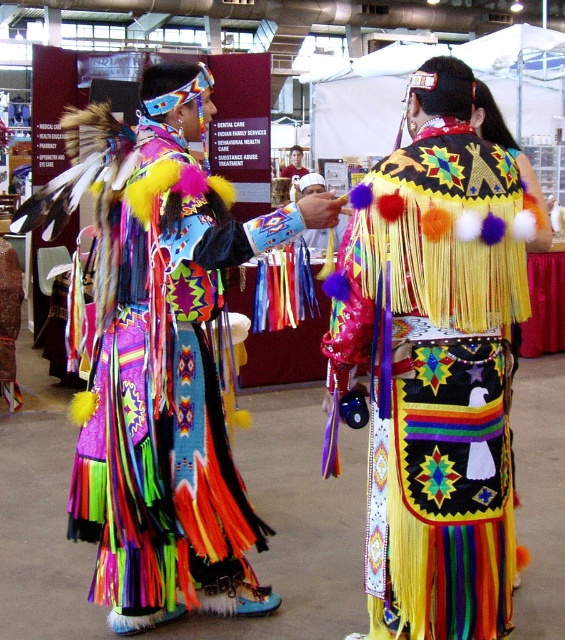
You are standing at the center of the image and see a point marked at coordinates (436, 376). Which object is this point located on?

The point at coordinates (436, 376) is located on the multicolored fringed dress at center.

You are at the cultural event and want to take a photo of the multicolored fringed dress at center. Where should you position yourself to capture the dress in the best possible angle?

The multicolored fringed dress at center is located at point (436,376), so you should position yourself directly in front of that coordinate to capture the dress at its most flattering angle.